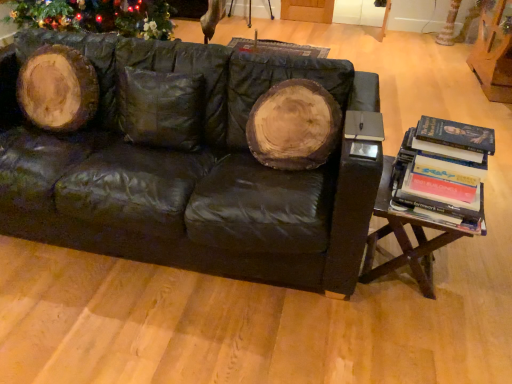
What are the coordinates of `free spot in front of woodenmaterial/texturetable at right` in the screenshot? It's located at (422, 342).